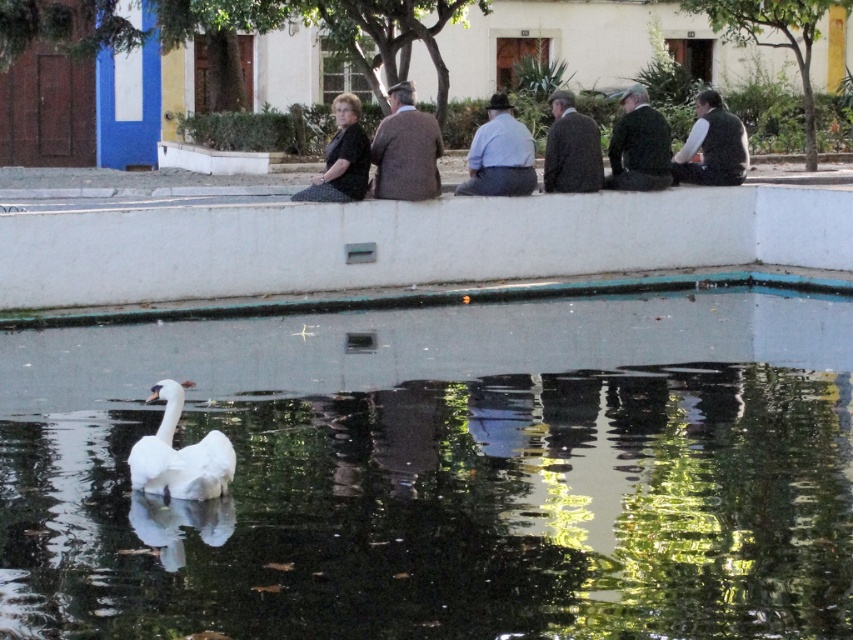
Between clear glass pool at center and brown wool sweater at center, which one has more height?

brown wool sweater at center

Can you confirm if clear glass pool at center is thinner than brown wool sweater at center?

Yes.

Which is behind, point (624, 492) or point (378, 129)?

Positioned behind is point (378, 129).

Locate an element on the screen. clear glass pool at center is located at coordinates click(x=442, y=472).

Does point (399, 182) lie in front of point (703, 145)?

Yes, it is in front of point (703, 145).

Is brown wool sweater at center shorter than green textured vest at right?

In fact, brown wool sweater at center may be taller than green textured vest at right.

Which is in front, point (393, 113) or point (712, 140)?

Positioned in front is point (393, 113).

Where is `brown wool sweater at center`? The width and height of the screenshot is (853, 640). brown wool sweater at center is located at coordinates (405, 148).

Image resolution: width=853 pixels, height=640 pixels. What do you see at coordinates (498, 154) in the screenshot?
I see `light blue shirt at center` at bounding box center [498, 154].

Does light blue shirt at center appear on the right side of black dotted dress at center?

Yes, light blue shirt at center is to the right of black dotted dress at center.

At what (x,y) coordinates should I click in order to perform the action: click on light blue shirt at center. Please return your answer as a coordinate pair (x, y). Looking at the image, I should click on (498, 154).